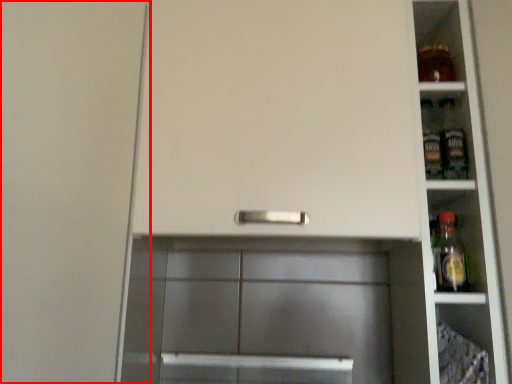
Question: From the image's perspective, where is door (annotated by the red box) located in relation to shelf in the image?

Choices:
 (A) above
 (B) below

Answer: (B)